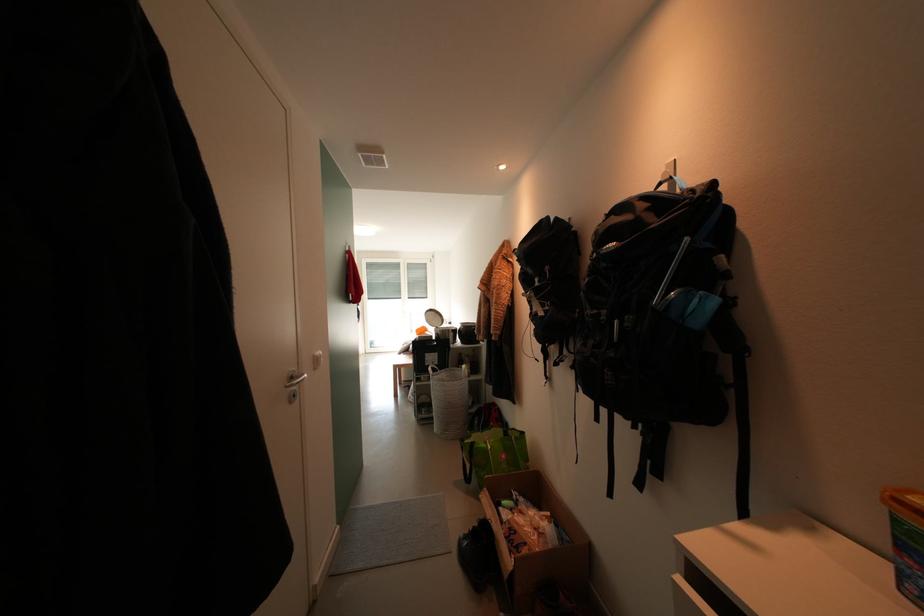
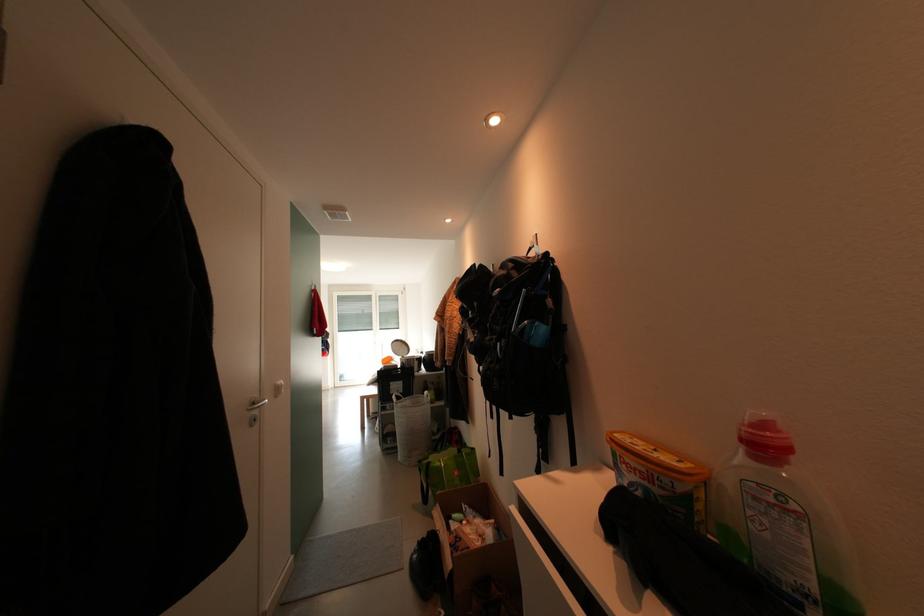
In the second image, find the point that corresponds to (450,378) in the first image.

(415, 405)